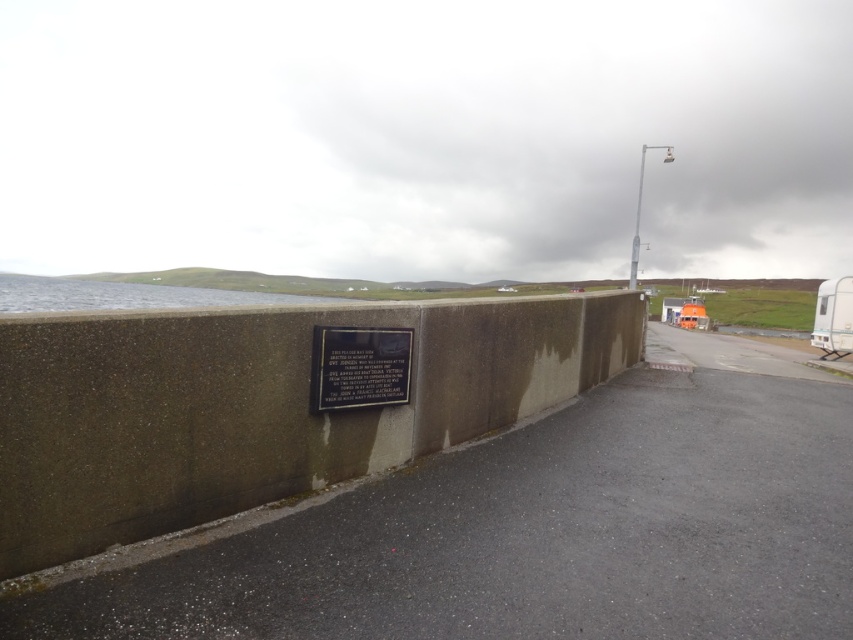
You are a painter who wants to paint the scene. You have a canvas that can only accommodate objects up to the width of the metallic pole at upper right. Can you fit the concrete wall at center onto your canvas?

The concrete wall at center is narrower than the metallic pole at upper right, so yes, the concrete wall at center can fit on the canvas since its width is less than the maximum width allowed.

You are a tourist visiting the coastal area and want to take a photo of both the concrete wall at center and the black polished stone plaque at center. Since you want to include both in the frame, which object should you focus on to ensure both are visible?

You should focus on the concrete wall at center because it is larger in size than the black polished stone plaque at center, so it will be easier to capture both in the frame by centering the larger object.